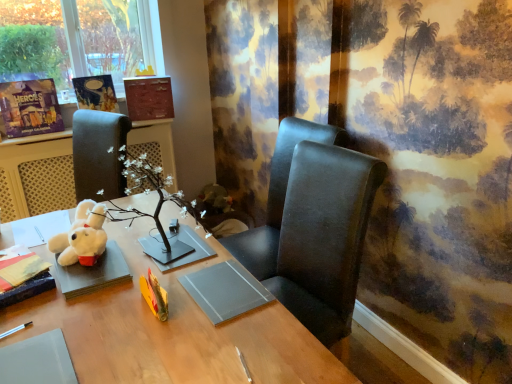
Identify the location of vacant space behind white plush toy at lower left. (125, 228).